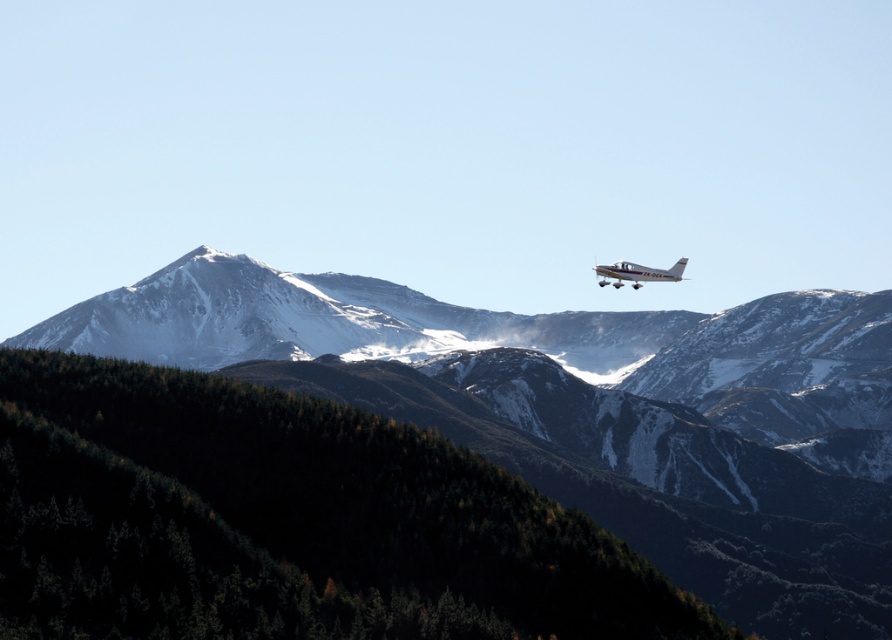
Between snowy rocky mountain range at upper center and silver metallic airplane at upper right, which one is positioned lower?

snowy rocky mountain range at upper center

Can you confirm if snowy rocky mountain range at upper center is shorter than silver metallic airplane at upper right?

No, snowy rocky mountain range at upper center is not shorter than silver metallic airplane at upper right.

Does point (345, 312) come closer to viewer compared to point (626, 273)?

No, (345, 312) is further to viewer.

Locate an element on the screen. snowy rocky mountain range at upper center is located at coordinates (587, 412).